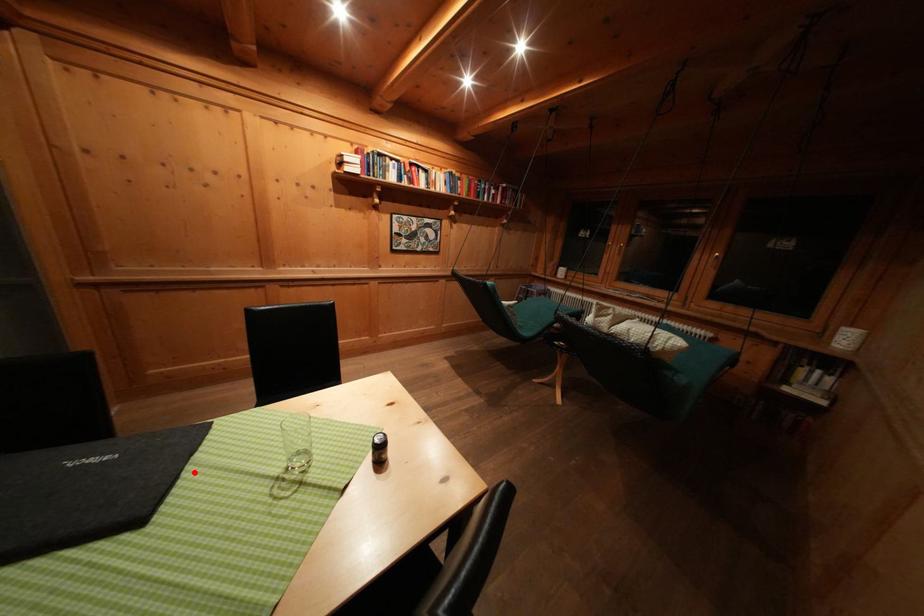
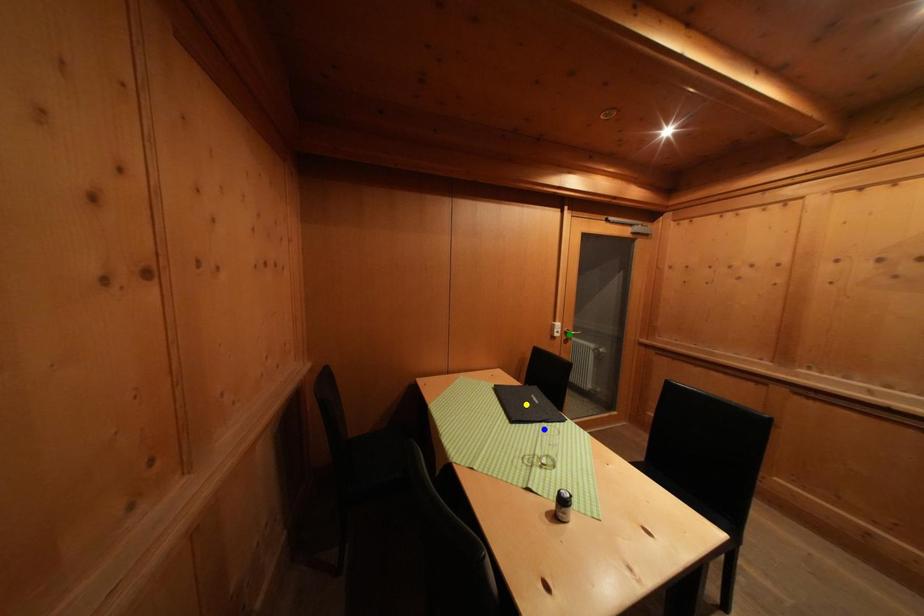
Question: I am providing you with two images of the same scene from different viewpoints. A red point is marked on the first image. You are given multiple points on the second image. Which mark in image 2 goes with the point in image 1?

Choices:
 (A) green point
 (B) blue point
 (C) yellow point

Answer: (B)